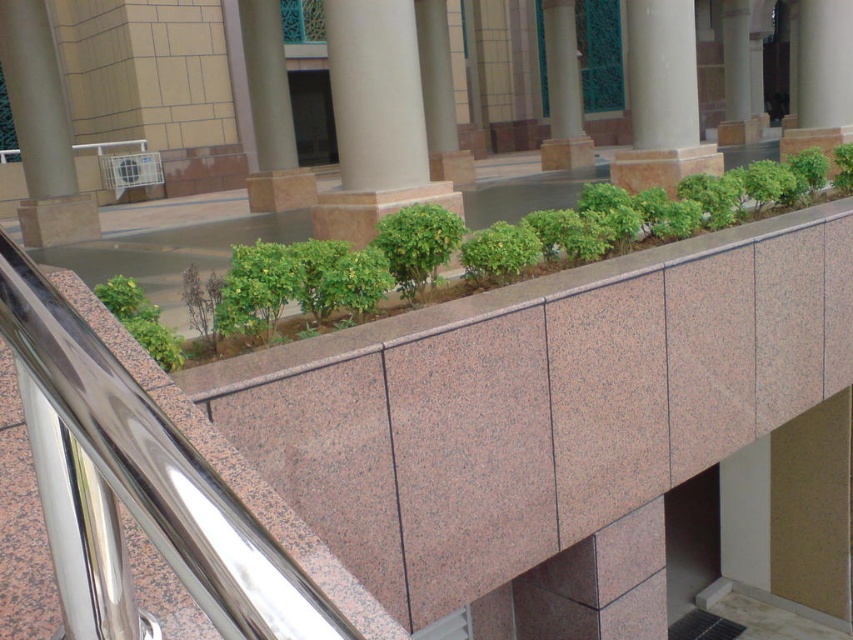
Is beige polished stone pillar at upper left bigger than green leafy shrub at upper left?

Indeed, beige polished stone pillar at upper left has a larger size compared to green leafy shrub at upper left.

This screenshot has width=853, height=640. I want to click on beige polished stone pillar at upper left, so click(41, 131).

At what (x,y) coordinates should I click in order to perform the action: click on beige polished stone pillar at upper left. Please return your answer as a coordinate pair (x, y). The width and height of the screenshot is (853, 640). Looking at the image, I should click on (41, 131).

Is smooth beige column at center shorter than green leafy shrub at upper left?

In fact, smooth beige column at center may be taller than green leafy shrub at upper left.

Who is positioned more to the left, smooth beige column at center or green leafy shrub at upper left?

green leafy shrub at upper left

Does point (634, 186) lie behind point (173, 364)?

Yes, it is.

Find the location of a particular element. smooth beige column at center is located at coordinates (662, 99).

Does smooth beige column at center come in front of brown polished stone pillar at center?

Yes.

Which is below, smooth beige column at center or brown polished stone pillar at center?

brown polished stone pillar at center is lower down.

Does point (694, 29) come farther from viewer compared to point (250, 83)?

That is True.

In order to click on smooth beige column at center in this screenshot , I will do `click(662, 99)`.